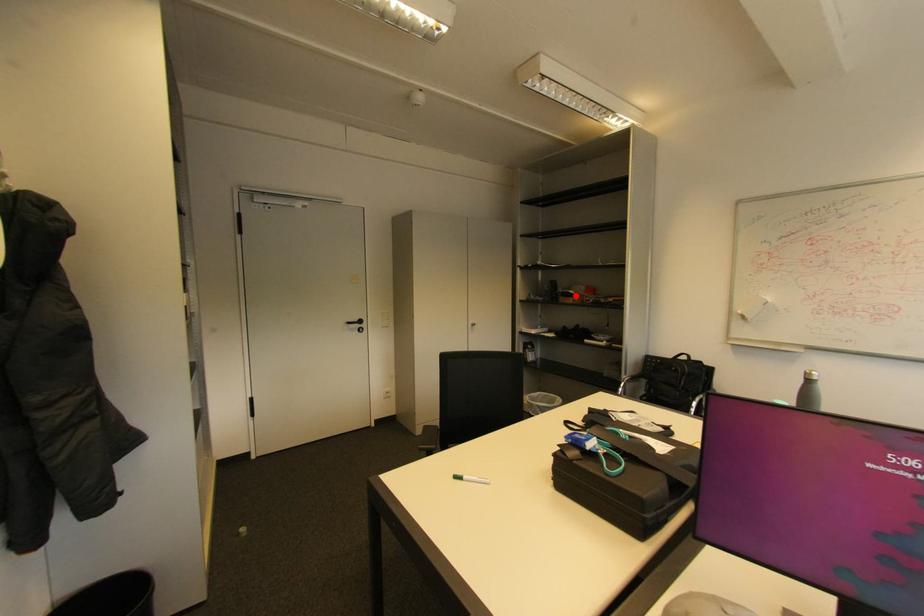
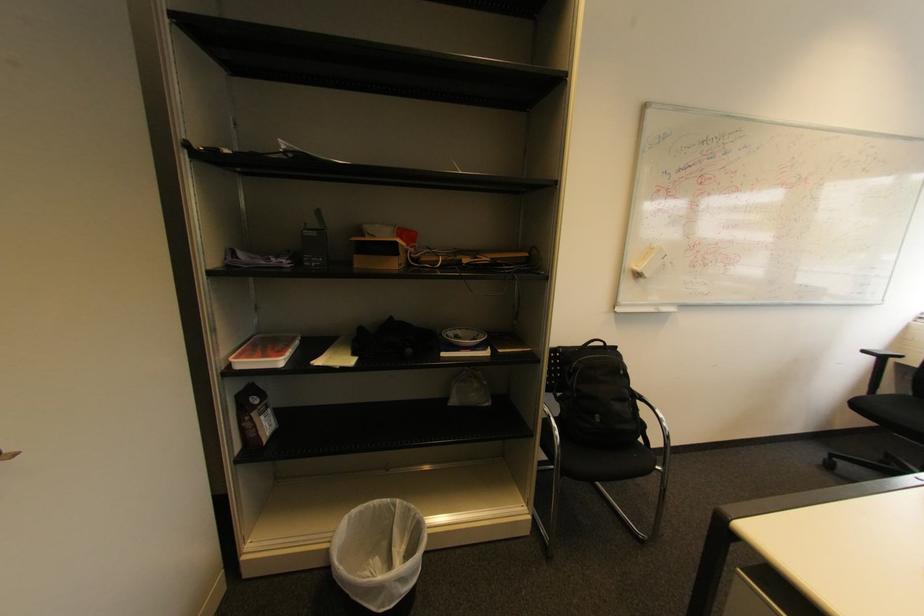
Find the pixel in the second image that matches the highlighted location in the first image.

(395, 251)